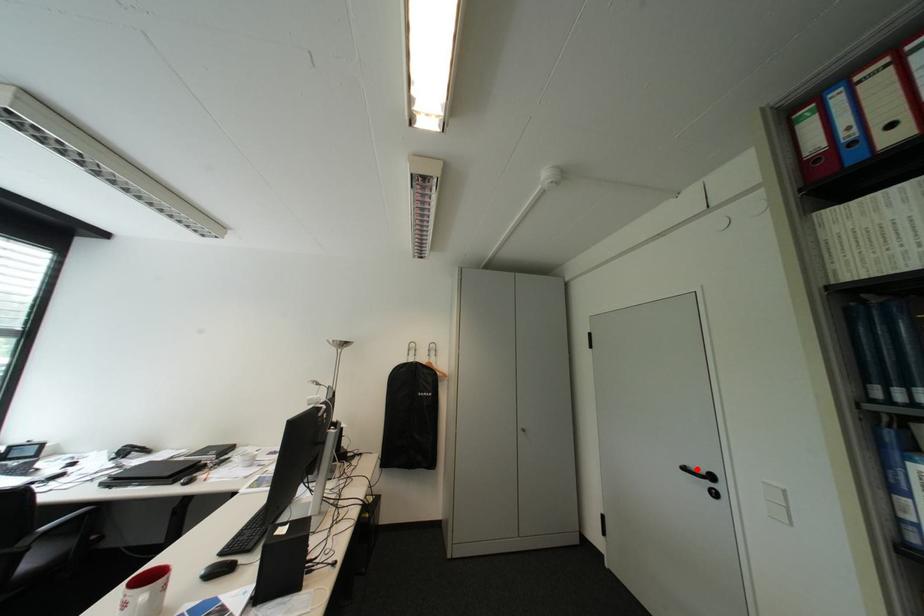
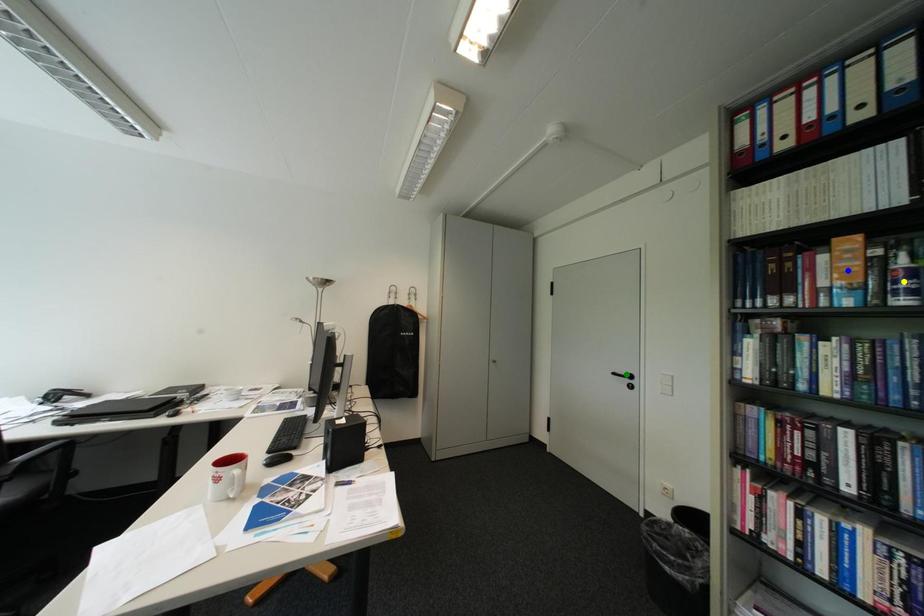
Question: I am providing you with two images of the same scene from different viewpoints. A red point is marked on the first image. You are given multiple points on the second image. In image 2, which mark is for the same physical point as the one in image 1?

Choices:
 (A) yellow point
 (B) blue point
 (C) green point

Answer: (C)